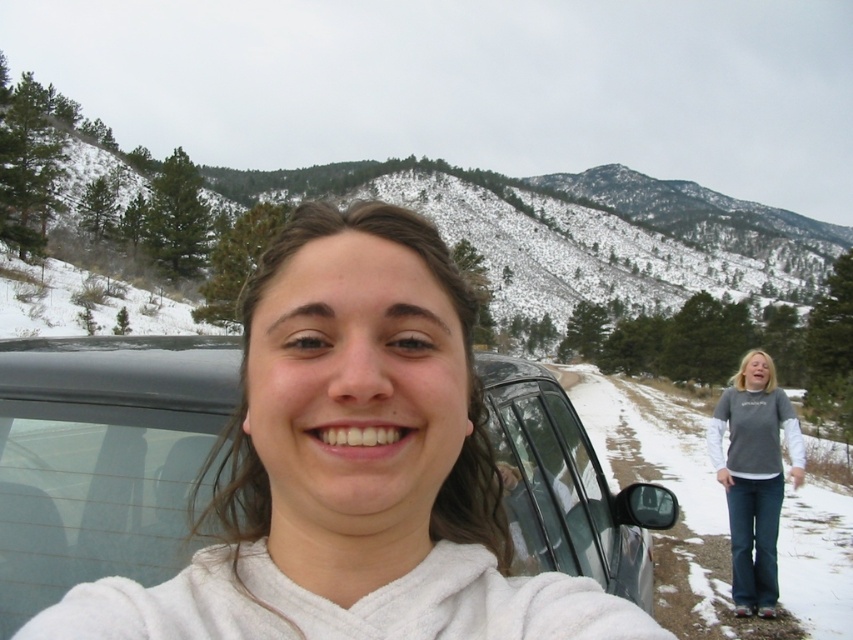
Question: Can you confirm if snowy forested mountain at upper center is positioned to the right of transparent glass car window at center?

Choices:
 (A) no
 (B) yes

Answer: (B)

Question: Which of these objects is positioned closest to the metallic gray car at center?

Choices:
 (A) snowy forested mountain at upper center
 (B) transparent glass car window at center

Answer: (B)

Question: Among these objects, which one is farthest from the camera?

Choices:
 (A) snowy forested mountain at upper center
 (B) gray cotton shirt at lower right
 (C) transparent glass car window at center
 (D) metallic gray car at center

Answer: (A)

Question: Does metallic gray car at center appear on the right side of snowy forested mountain at upper center?

Choices:
 (A) no
 (B) yes

Answer: (A)

Question: Estimate the real-world distances between objects in this image. Which object is closer to the metallic gray car at center?

Choices:
 (A) snowy forested mountain at upper center
 (B) transparent glass car window at center
 (C) gray cotton shirt at lower right

Answer: (B)

Question: Observing the image, what is the correct spatial positioning of gray cotton shirt at lower right in reference to transparent glass car window at center?

Choices:
 (A) right
 (B) left

Answer: (A)